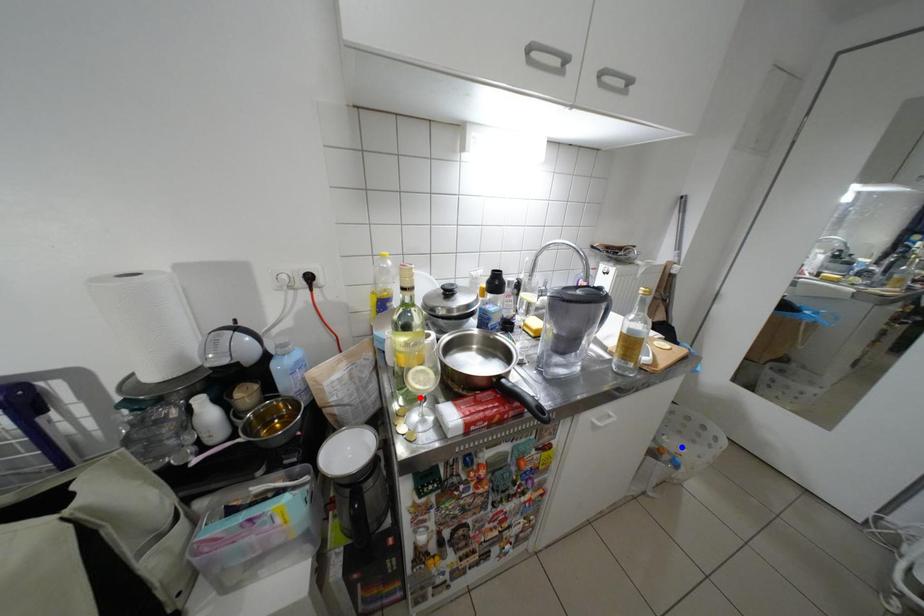
Question: In the image, two points are highlighted. Which point is nearer to the camera? Reply with the corresponding letter.

Choices:
 (A) blue point
 (B) red point

Answer: (B)